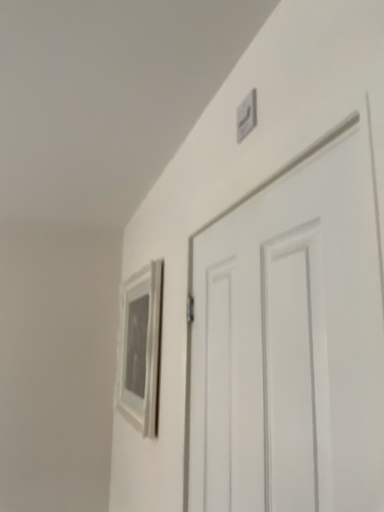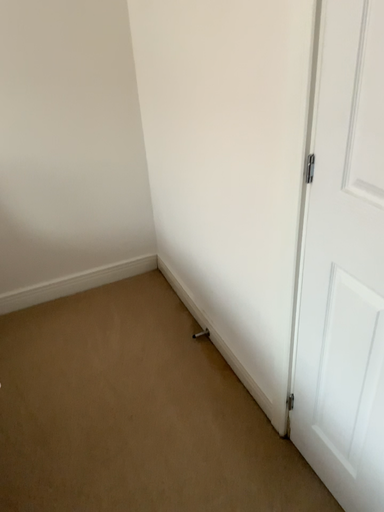
Question: Which way did the camera rotate in the video?

Choices:
 (A) rotated right
 (B) rotated left

Answer: (A)